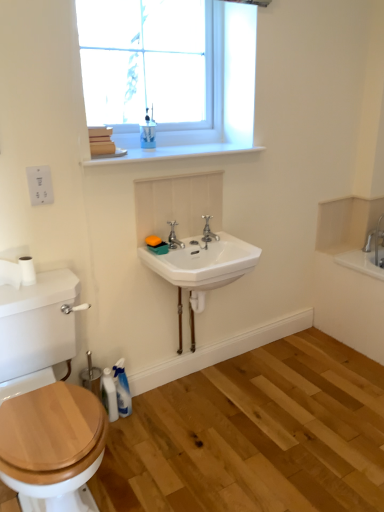
I want to click on white glossy window sill at upper center, so click(174, 153).

This screenshot has width=384, height=512. Describe the element at coordinates (148, 132) in the screenshot. I see `blue glossy cup at upper center, the 1th toiletry viewed from the right` at that location.

Locate an element on the screen. white glossy window sill at upper center is located at coordinates (174, 153).

Consider the image. Considering the sizes of white glossy window sill at upper center and white matte toilet paper at left in the image, is white glossy window sill at upper center bigger or smaller than white matte toilet paper at left?

Clearly, white glossy window sill at upper center is larger in size than white matte toilet paper at left.

Who is more distant, white glossy window sill at upper center or white matte toilet paper at left?

white glossy window sill at upper center.

Locate an element on the screen. The image size is (384, 512). toilet paper beneath the white glossy window sill at upper center (from a real-world perspective) is located at coordinates (27, 270).

Between polished chrome faucet at center, marked as the 1th tap in a right-to-left arrangement, and clear glass window at upper center, which one is positioned in front?

clear glass window at upper center is closer to the camera.

Which is more to the left, polished chrome faucet at center, marked as the 1th tap in a right-to-left arrangement, or clear glass window at upper center?

clear glass window at upper center is more to the left.

Who is bigger, polished chrome faucet at center, acting as the second tap starting from the left, or clear glass window at upper center?

clear glass window at upper center.

Is polished chrome faucet at center, acting as the second tap starting from the left, facing towards clear glass window at upper center?

No.

Could you measure the distance between blue glossy cup at upper center, the 1th toiletry viewed from the right, and clear glass window at upper center?

blue glossy cup at upper center, the 1th toiletry viewed from the right, is 12.46 inches from clear glass window at upper center.

Is blue glossy cup at upper center, positioned as the second toiletry in bottom-to-top order, at the left side of clear glass window at upper center?

Yes.

From the picture: From a real-world perspective, is blue glossy cup at upper center, the 2th toiletry when ordered from left to right, above or below clear glass window at upper center?

Clearly, from a real-world perspective, blue glossy cup at upper center, the 2th toiletry when ordered from left to right, is below clear glass window at upper center.

Which of these two, blue glossy cup at upper center, the 1th toiletry viewed from the right, or clear glass window at upper center, stands shorter?

With less height is blue glossy cup at upper center, the 1th toiletry viewed from the right.

From the image's perspective, would you say white glossy bottle at lower left is shown under translucent plastic spray bottle at lower left, the 1th toiletry in the bottom-to-top sequence?

Yes, from the image's perspective, white glossy bottle at lower left is beneath translucent plastic spray bottle at lower left, the 1th toiletry in the bottom-to-top sequence.

Is white glossy bottle at lower left in contact with translucent plastic spray bottle at lower left, the 2th toiletry viewed from the top?

Absolutely, white glossy bottle at lower left is next to and touching translucent plastic spray bottle at lower left, the 2th toiletry viewed from the top.

Is translucent plastic spray bottle at lower left, the 1th toiletry in the bottom-to-top sequence, completely or partially inside white glossy bottle at lower left?

No, translucent plastic spray bottle at lower left, the 1th toiletry in the bottom-to-top sequence, is not a part of white glossy bottle at lower left.

Is white matte toilet paper at left outside of blue glossy cup at upper center, the 1th toiletry viewed from the right?

Yes, white matte toilet paper at left is not within blue glossy cup at upper center, the 1th toiletry viewed from the right.

Considering the positions of points (21, 269) and (151, 142), is point (21, 269) farther from camera compared to point (151, 142)?

No, (21, 269) is closer to viewer.

Can you confirm if white matte toilet paper at left is taller than blue glossy cup at upper center, acting as the 1th toiletry starting from the top?

In fact, white matte toilet paper at left may be shorter than blue glossy cup at upper center, acting as the 1th toiletry starting from the top.

Could you tell me if white matte toilet paper at left is facing blue glossy cup at upper center, the 2th toiletry when ordered from left to right?

No, white matte toilet paper at left is not turned towards blue glossy cup at upper center, the 2th toiletry when ordered from left to right.

Identify the location of the 1st toiletry positioned below the clear glass window at upper center (from a real-world perspective). (148, 132).

Between point (138, 112) and point (143, 137), which one is positioned behind?

The point (138, 112) is more distant.

Is blue glossy cup at upper center, acting as the 1th toiletry starting from the top, a part of clear glass window at upper center?

No, blue glossy cup at upper center, acting as the 1th toiletry starting from the top, is not a part of clear glass window at upper center.

Would you say white ceramic sink at center is inside or outside silver metallic faucet at center, the first tap positioned from the left?

white ceramic sink at center lies outside silver metallic faucet at center, the first tap positioned from the left.

Which point is more distant from viewer, (x=215, y=256) or (x=172, y=246)?

The point (x=215, y=256) is farther.

From a real-world perspective, is white ceramic sink at center over silver metallic faucet at center, which appears as the second tap when viewed from the right?

No, from a real-world perspective, white ceramic sink at center is not on top of silver metallic faucet at center, which appears as the second tap when viewed from the right.

At what (x,y) coordinates should I click in order to perform the action: click on window sill behind the white matte toilet paper at left. Please return your answer as a coordinate pair (x, y). Looking at the image, I should click on (174, 153).

From the clear glass window at upper center, count 2nd tap to the right and point to it. Please provide its 2D coordinates.

[(208, 230)]

From the image, which object appears to be farther from blue glossy cup at upper center, the 1th toiletry viewed from the right, silver metallic faucet at center, which appears as the second tap when viewed from the right, or translucent plastic spray bottle at lower left, the 2th toiletry from the right?

translucent plastic spray bottle at lower left, the 2th toiletry from the right, lies further to blue glossy cup at upper center, the 1th toiletry viewed from the right, than the other object.

Estimate the real-world distances between objects in this image. Which object is closer to white matte toilet paper at left, white ceramic sink at center or white glossy window sill at upper center?

white glossy window sill at upper center is positioned closer to the anchor white matte toilet paper at left.

Looking at the image, which one is located closer to white glossy bottle at lower left, white ceramic sink at center or translucent plastic spray bottle at lower left, the 2th toiletry from the right?

translucent plastic spray bottle at lower left, the 2th toiletry from the right, is closer to white glossy bottle at lower left.

Which object lies nearer to the anchor point white matte toilet paper at left, white plastic electric outlet at upper left or translucent plastic spray bottle at lower left, the 1th toiletry in the bottom-to-top sequence?

white plastic electric outlet at upper left lies closer to white matte toilet paper at left than the other object.

Looking at the image, which one is located further to white plastic electric outlet at upper left, translucent plastic spray bottle at lower left, the 2th toiletry viewed from the top, or white matte toilet paper at left?

translucent plastic spray bottle at lower left, the 2th toiletry viewed from the top, is positioned further to the anchor white plastic electric outlet at upper left.

When comparing their distances from silver metallic faucet at center, which appears as the second tap when viewed from the right, does white ceramic sink at center or white matte toilet paper at left seem closer?

Among the two, white ceramic sink at center is located nearer to silver metallic faucet at center, which appears as the second tap when viewed from the right.

Based on their spatial positions, is white ceramic sink at center or blue glossy cup at upper center, acting as the 1th toiletry starting from the top, further from white plastic electric outlet at upper left?

Among the two, white ceramic sink at center is located further to white plastic electric outlet at upper left.

Looking at the image, which one is located closer to white plastic electric outlet at upper left, clear glass window at upper center or blue glossy cup at upper center, acting as the 1th toiletry starting from the top?

The object closer to white plastic electric outlet at upper left is blue glossy cup at upper center, acting as the 1th toiletry starting from the top.

Where is `toilet paper between blue glossy cup at upper center, the 1th toiletry viewed from the right, and white glossy bottle at lower left from top to bottom`? The width and height of the screenshot is (384, 512). toilet paper between blue glossy cup at upper center, the 1th toiletry viewed from the right, and white glossy bottle at lower left from top to bottom is located at coordinates (27, 270).

Where is `electric outlet between clear glass window at upper center and white ceramic sink at center in the vertical direction`? electric outlet between clear glass window at upper center and white ceramic sink at center in the vertical direction is located at coordinates (40, 185).

Identify the location of toilet paper between polished chrome faucet at center, marked as the 1th tap in a right-to-left arrangement, and white glossy bottle at lower left vertically. (27, 270).

At what (x,y) coordinates should I click in order to perform the action: click on toiletry between white ceramic sink at center and white glossy bottle at lower left from top to bottom. Please return your answer as a coordinate pair (x, y). The width and height of the screenshot is (384, 512). Looking at the image, I should click on (122, 389).